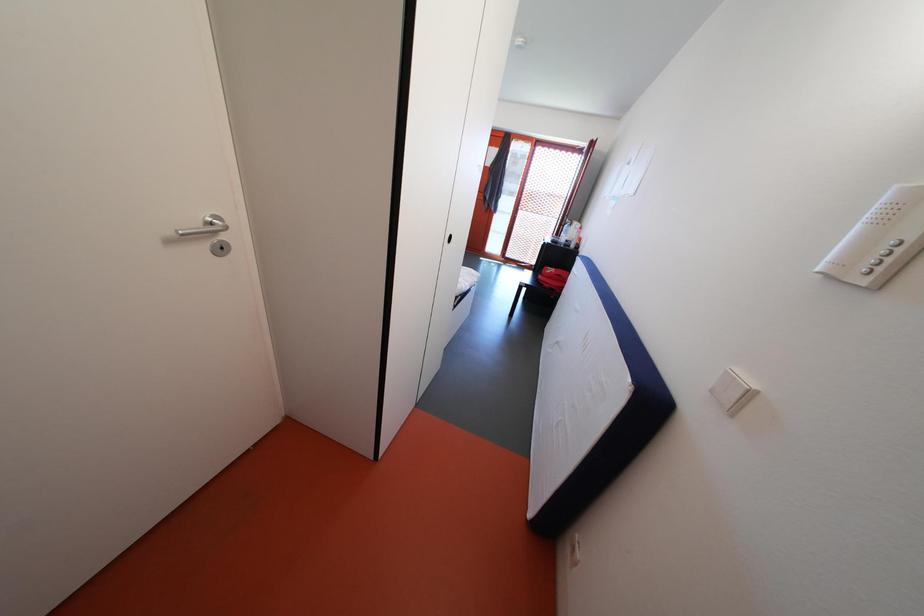
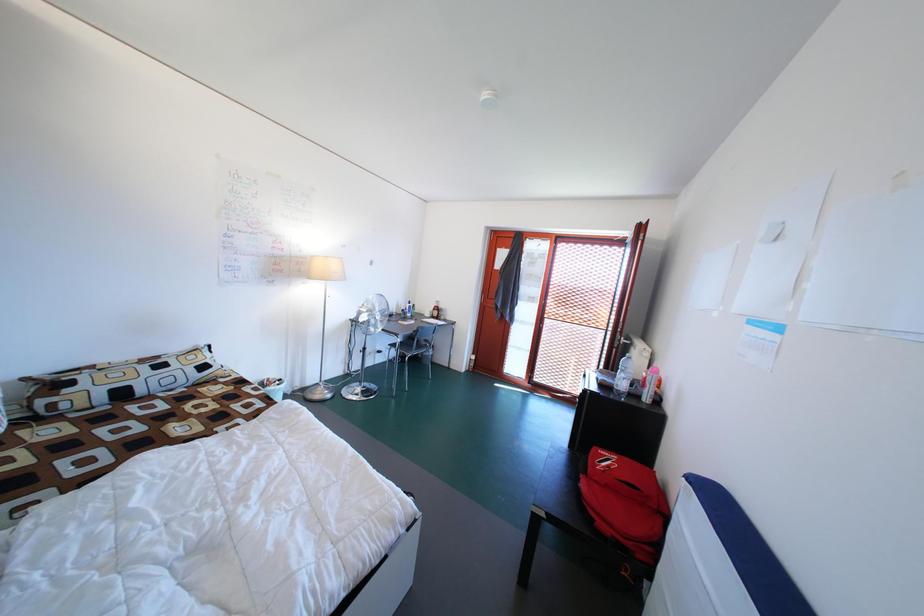
What movement of the cameraman would produce the second image?

The cameraman walked toward right, forward.